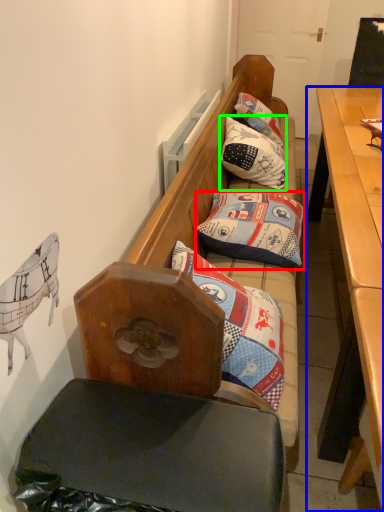
Question: Which is farther away from pillow (highlighted by a red box)? desk (highlighted by a blue box) or pillow (highlighted by a green box)?

Choices:
 (A) desk
 (B) pillow

Answer: (B)